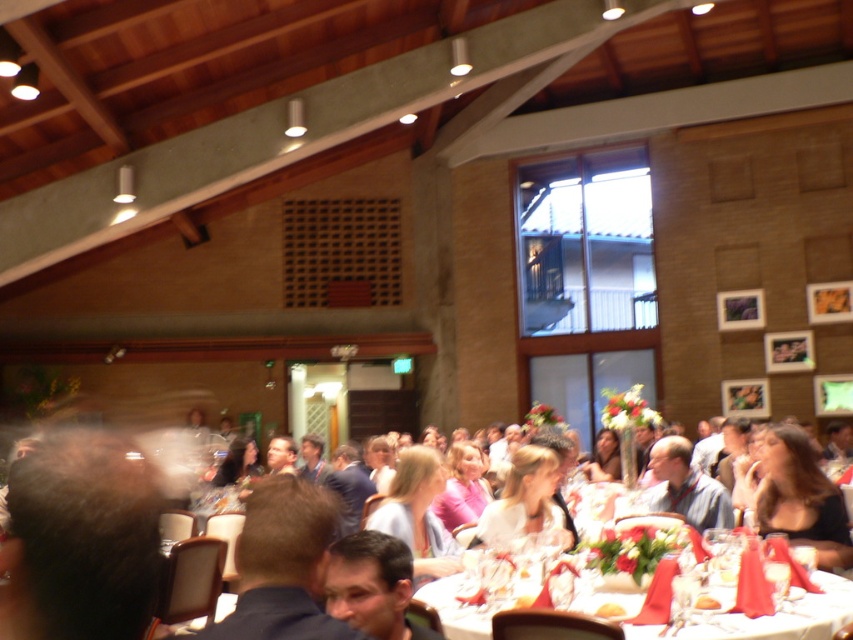
Question: Which point is farther to the camera?

Choices:
 (A) yellow cake at center
 (B) white tablecloth at center

Answer: (A)

Question: Does white tablecloth at center appear on the right side of white glossy bread at lower right?

Choices:
 (A) yes
 (B) no

Answer: (A)

Question: Based on their relative distances, which object is nearer to the white tablecloth at center?

Choices:
 (A) white glossy bread at lower right
 (B) yellow cake at center

Answer: (A)

Question: Where is white tablecloth at center located in relation to white glossy bread at lower right in the image?

Choices:
 (A) below
 (B) above

Answer: (A)

Question: Can you confirm if white tablecloth at center is positioned above yellow cake at center?

Choices:
 (A) yes
 (B) no

Answer: (B)

Question: Which of the following is the closest to the observer?

Choices:
 (A) yellow cake at center
 (B) white glossy bread at lower right
 (C) white tablecloth at center

Answer: (C)